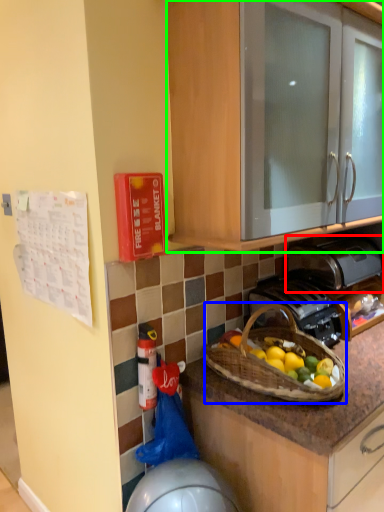
Question: Which is nearer to the toaster (highlighted by a red box)? picnic basket (highlighted by a blue box) or cabinetry (highlighted by a green box).

Choices:
 (A) picnic basket
 (B) cabinetry

Answer: (A)